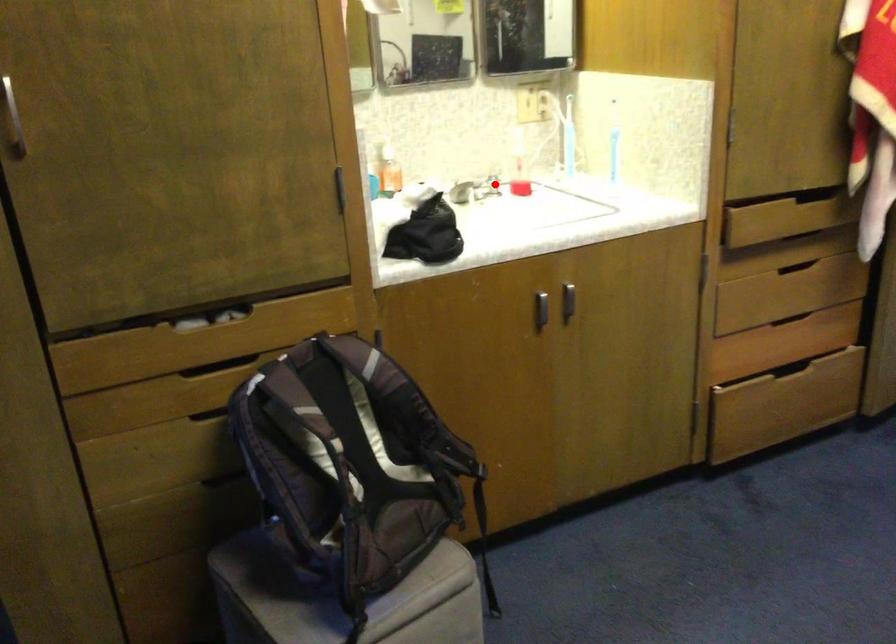
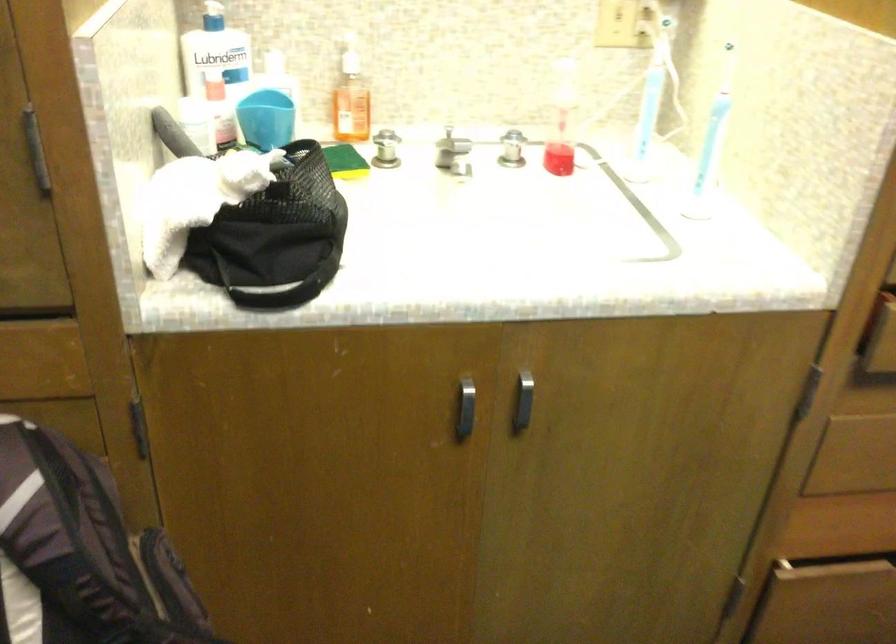
Question: A red point is marked in image1. In image2, is the corresponding 3D point closer to the camera or farther? Reply with the corresponding letter.

Choices:
 (A) The corresponding 3D point is closer.
 (B) The corresponding 3D point is farther.

Answer: (A)